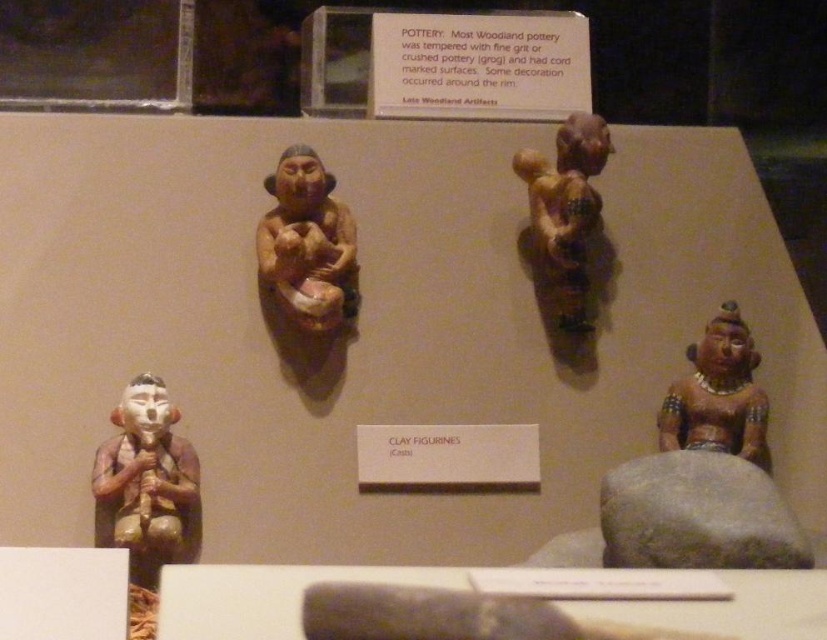
Question: Can you confirm if matte clay figurine at center is positioned to the right of brown matte figurine at center-right?

Choices:
 (A) yes
 (B) no

Answer: (B)

Question: Which point is farther to the camera?

Choices:
 (A) (703, 397)
 (B) (352, 225)

Answer: (B)

Question: Is matte clay figurine at center to the left of matte clay figurine at lower right from the viewer's perspective?

Choices:
 (A) no
 (B) yes

Answer: (B)

Question: Among these objects, which one is nearest to the camera?

Choices:
 (A) matte clay figurine at center
 (B) brown matte figurine at center-right
 (C) matte clay figurine at lower right

Answer: (C)

Question: Observing the image, what is the correct spatial positioning of matte clay figurine at center in reference to brown matte figurine at center-right?

Choices:
 (A) below
 (B) above

Answer: (A)

Question: Which point is closer to the camera taking this photo?

Choices:
 (A) (586, 195)
 (B) (355, 280)
 (C) (113, 412)
 (D) (708, 410)

Answer: (C)